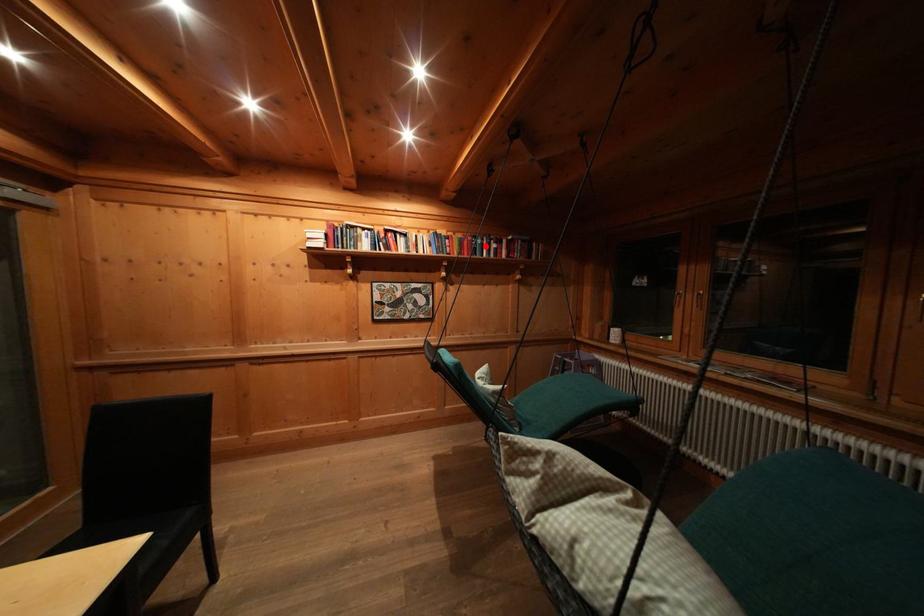
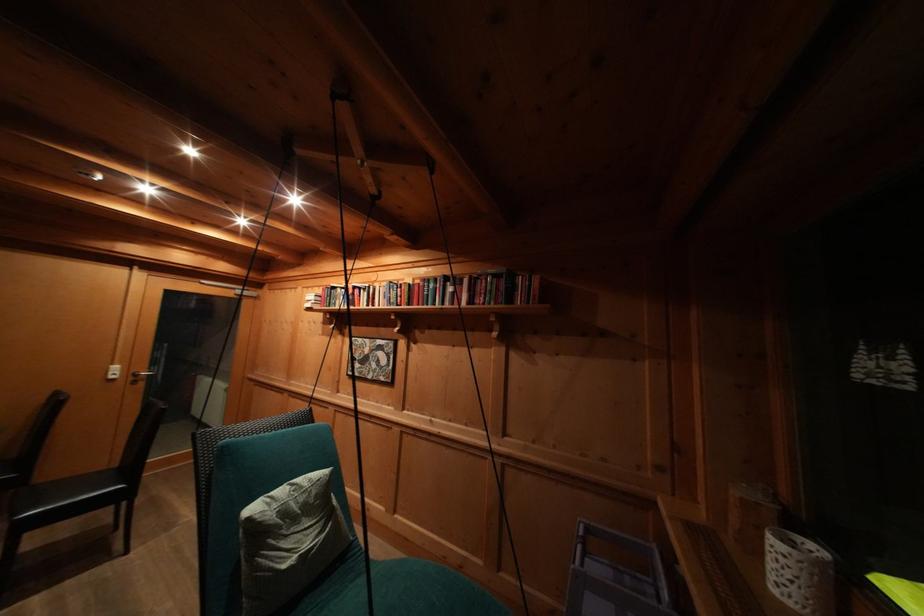
In the second image, find the point that corresponds to the highlighted location in the first image.

(438, 291)